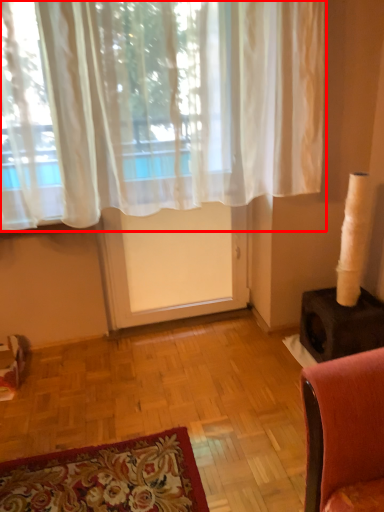
Question: From the image, what is the correct spatial relationship of curtain (annotated by the red box) in relation to screen door?

Choices:
 (A) right
 (B) left

Answer: (A)